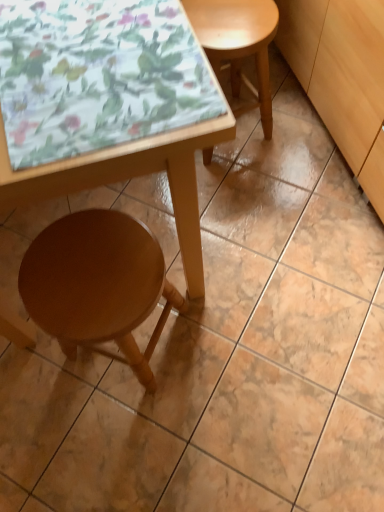
Identify the location of unoccupied region to the right of wooden stool at lower left, the first stool viewed from the left. (234, 334).